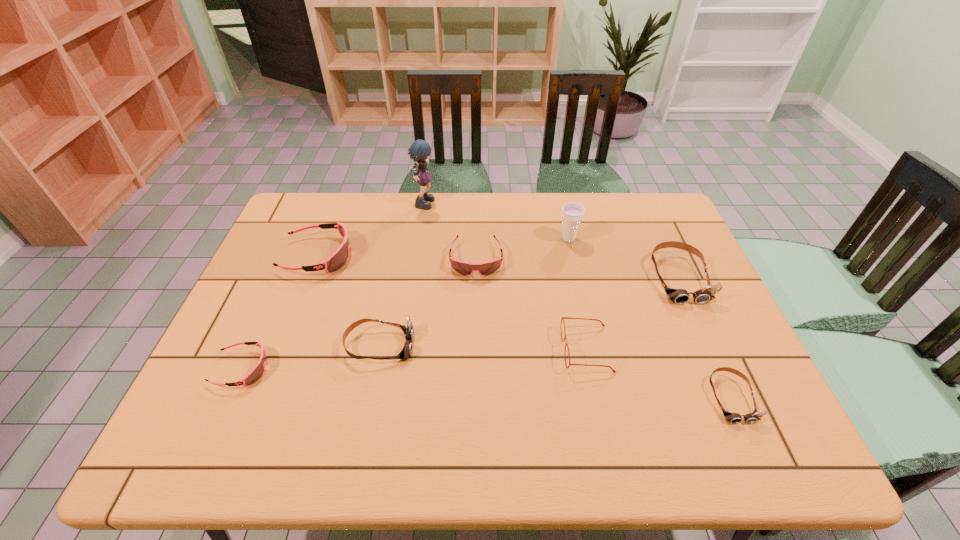
At what (x,y) coordinates should I click in order to perform the action: click on spectacles. Please return your answer as a coordinate pair (x, y). Looking at the image, I should click on (563, 318).

Identify the location of the smallest pink goggles. (256, 373).

The height and width of the screenshot is (540, 960). I want to click on the smallest brown goggles, so click(734, 418).

Identify the location of free spot located 0.260m on the front-facing side of the tallest object. This screenshot has width=960, height=540. (511, 201).

This screenshot has width=960, height=540. Find the location of `vacant area situated on the right of the eighth shortest object`. vacant area situated on the right of the eighth shortest object is located at coordinates (663, 239).

I want to click on vacant space situated 0.050m on the front-facing side of the biggest pink goggles, so click(x=369, y=255).

Where is `free space located 0.370m on the front-facing side of the biggest brown goggles`? This screenshot has height=540, width=960. free space located 0.370m on the front-facing side of the biggest brown goggles is located at coordinates coord(749,434).

I want to click on vacant space located on the front-facing side of the fifth object from right to left, so click(x=475, y=328).

This screenshot has height=540, width=960. What are the coordinates of `vacant region located on the front-facing side of the second farthest brown goggles` in the screenshot? It's located at (465, 346).

Find the location of a particular element. free location located on the face of the spectacles is located at coordinates (470, 349).